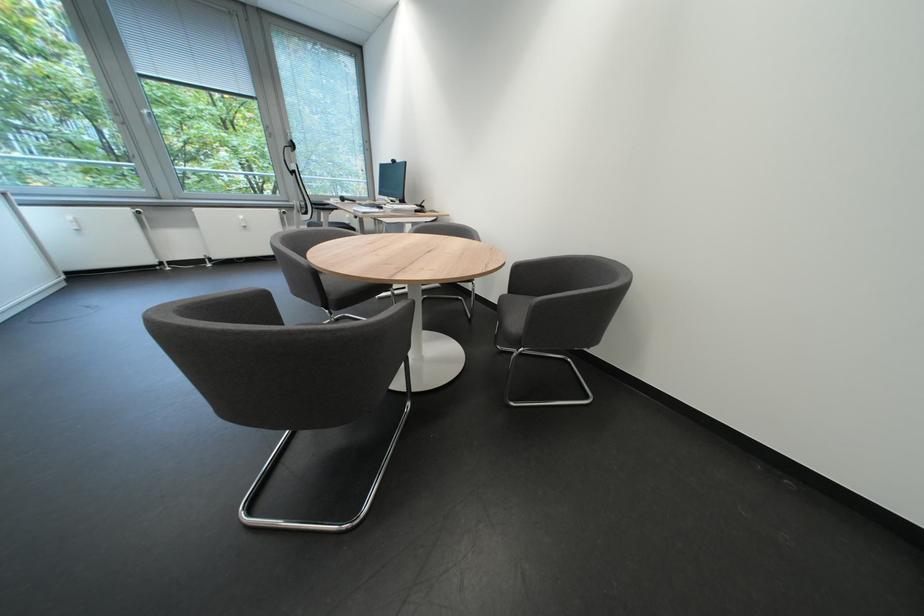
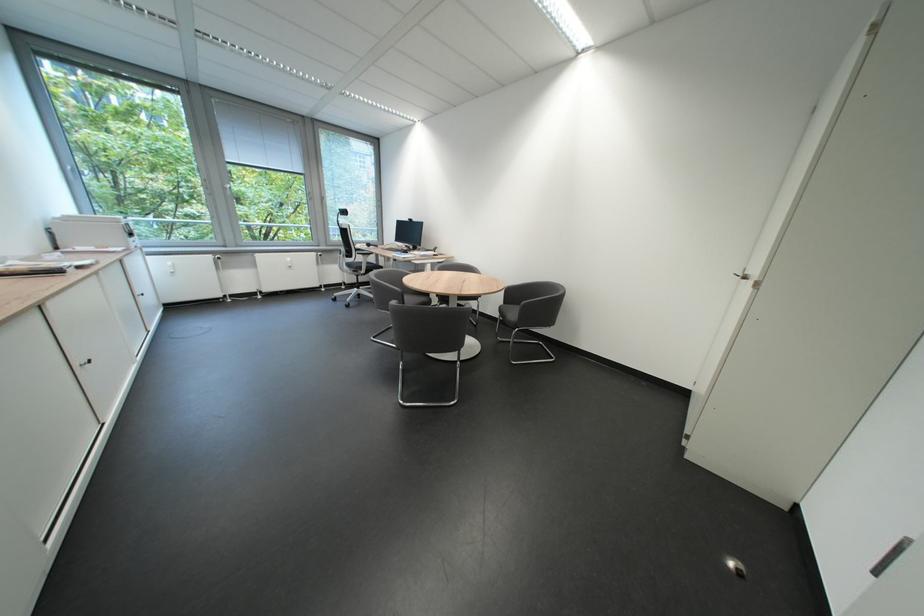
The images are taken continuously from a first-person perspective. In which direction are you moving?

The cameraman moved toward left, backward.